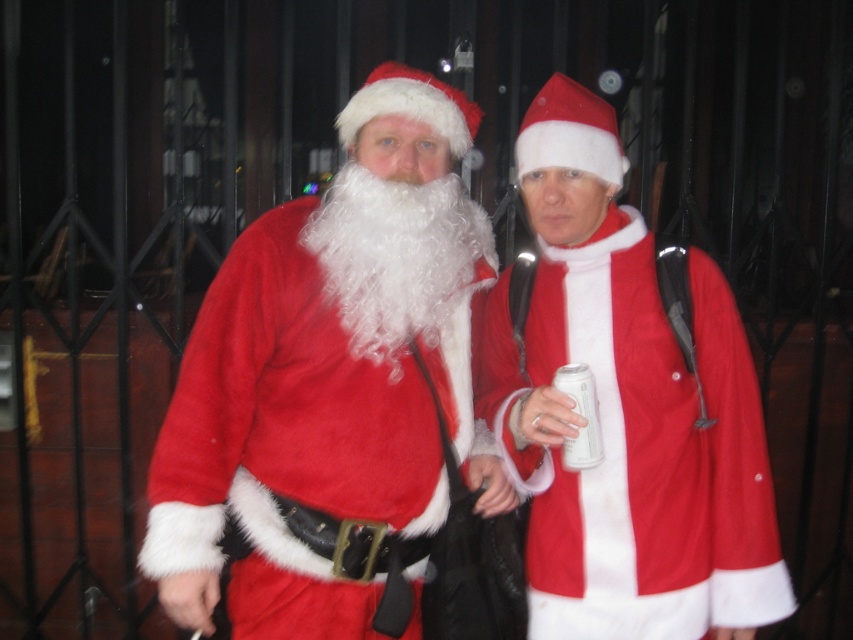
Question: Does fuzzy red santa at center lie in front of white curly fur beard at center?

Choices:
 (A) no
 (B) yes

Answer: (B)

Question: Which of the following is the closest to the observer?

Choices:
 (A) white curly fur beard at center
 (B) fuzzy red coat at center
 (C) fuzzy red santa at center
 (D) white matte can at center

Answer: (C)

Question: Estimate the real-world distances between objects in this image. Which object is closer to the fuzzy red santa at center?

Choices:
 (A) white curly fur beard at center
 (B) fuzzy red coat at center
 (C) white matte can at center

Answer: (A)

Question: Does white curly fur beard at center appear on the right side of white matte can at center?

Choices:
 (A) yes
 (B) no

Answer: (B)

Question: Does white curly fur beard at center have a larger size compared to white matte can at center?

Choices:
 (A) yes
 (B) no

Answer: (A)

Question: Based on their relative distances, which object is nearer to the white curly fur beard at center?

Choices:
 (A) white matte can at center
 (B) fuzzy red santa at center
 (C) fuzzy red coat at center

Answer: (B)